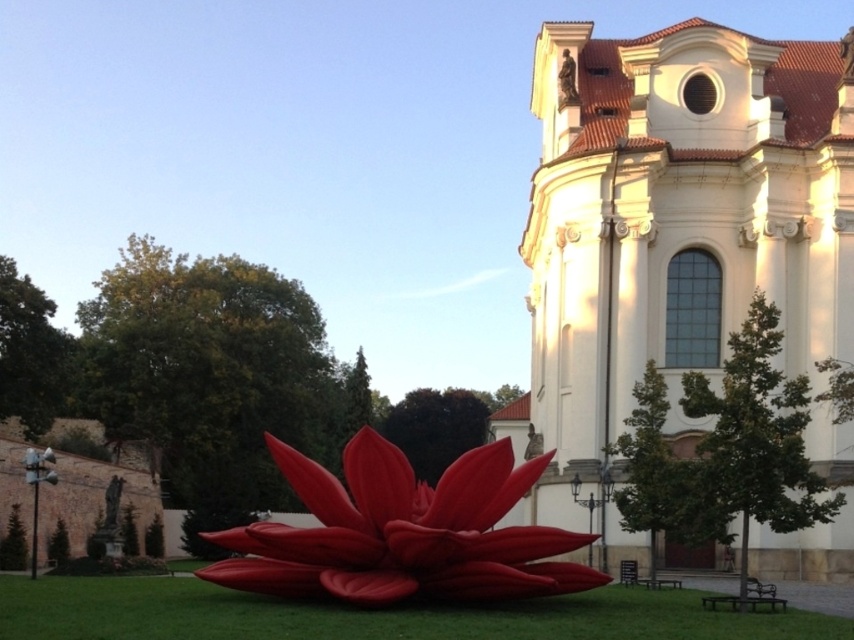
You are an artist planning to paint the scene. You want to ensure the matte red flower at center and the green grass at lower center are positioned correctly in terms of depth. Which object should appear closer to the viewer in your painting?

The matte red flower at center should appear closer to the viewer than the green grass at lower center because it is positioned further to the viewer in the scene.

You are standing in the grassy area in front of the matte red flower at center. If you look towards the church in the background, which direction should you face?

The matte red flower at center is located at point (402, 531), so facing towards the church in the background would mean turning to face the direction opposite to the matte red flower at center.